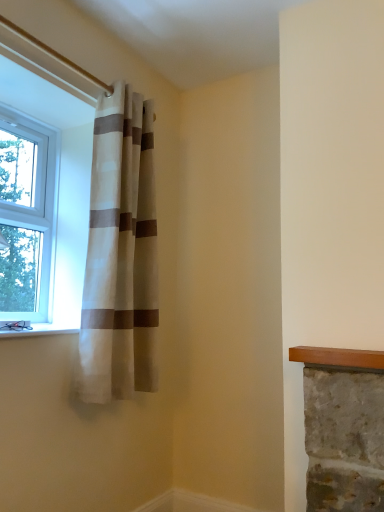
Describe the element at coordinates (40, 330) in the screenshot. The height and width of the screenshot is (512, 384). I see `white stone window sill at lower left` at that location.

The height and width of the screenshot is (512, 384). I want to click on beige/white striped curtain at upper left, so click(121, 254).

In order to click on window on the left of the white stone window sill at lower left in this screenshot , I will do coord(26,219).

Which object is more forward, clear glass window at left or white stone window sill at lower left?

white stone window sill at lower left is in front.

Is clear glass window at left next to white stone window sill at lower left?

No, clear glass window at left is not with white stone window sill at lower left.

Based on the photo, is white stone window sill at lower left next to clear glass window at left?

No, white stone window sill at lower left is not next to clear glass window at left.

Does white stone window sill at lower left turn towards clear glass window at left?

No, white stone window sill at lower left does not turn towards clear glass window at left.

Between white stone window sill at lower left and clear glass window at left, which one has smaller size?

white stone window sill at lower left is smaller.

Is point (55, 324) closer or farther from the camera than point (48, 264)?

Point (55, 324) is closer to the camera than point (48, 264).

Can you confirm if beige/white striped curtain at upper left is smaller than clear glass window at left?

No, beige/white striped curtain at upper left is not smaller than clear glass window at left.

Is point (152, 255) more distant than point (4, 255)?

Yes, it is behind point (4, 255).

Is beige/white striped curtain at upper left oriented away from clear glass window at left?

Yes, beige/white striped curtain at upper left's orientation is away from clear glass window at left.

From a real-world perspective, between beige/white striped curtain at upper left and clear glass window at left, who is vertically lower?

In real-world perspective, beige/white striped curtain at upper left is lower.

Which of these two, beige/white striped curtain at upper left or white stone window sill at lower left, stands taller?

beige/white striped curtain at upper left is taller.

Can you confirm if beige/white striped curtain at upper left is thinner than white stone window sill at lower left?

Yes, beige/white striped curtain at upper left is thinner than white stone window sill at lower left.

Looking at this image, is white stone window sill at lower left at the back of beige/white striped curtain at upper left?

No, beige/white striped curtain at upper left's orientation is not away from white stone window sill at lower left.

Is beige/white striped curtain at upper left further to the viewer compared to white stone window sill at lower left?

Yes, the depth of beige/white striped curtain at upper left is greater than that of white stone window sill at lower left.

Between white stone window sill at lower left and beige/white striped curtain at upper left, which one is positioned behind?

beige/white striped curtain at upper left is behind.

Is white stone window sill at lower left situated inside beige/white striped curtain at upper left or outside?

white stone window sill at lower left cannot be found inside beige/white striped curtain at upper left.

Based on the photo, from a real-world perspective, between white stone window sill at lower left and beige/white striped curtain at upper left, who is vertically higher?

From a 3D spatial view, beige/white striped curtain at upper left is above.

Is white stone window sill at lower left to the left of beige/white striped curtain at upper left from the viewer's perspective?

Yes, white stone window sill at lower left is to the left of beige/white striped curtain at upper left.

Which object is closer to the camera taking this photo, clear glass window at left or beige/white striped curtain at upper left?

beige/white striped curtain at upper left is closer to the camera.

Can you confirm if clear glass window at left is wider than beige/white striped curtain at upper left?

In fact, clear glass window at left might be narrower than beige/white striped curtain at upper left.

Choose the correct answer: Is clear glass window at left inside beige/white striped curtain at upper left or outside it?

clear glass window at left cannot be found inside beige/white striped curtain at upper left.

The width and height of the screenshot is (384, 512). I want to click on window sill below the clear glass window at left (from the image's perspective), so click(40, 330).

Identify the location of window sill that appears below the clear glass window at left (from a real-world perspective). (40, 330).

Which object lies nearer to the anchor point beige/white striped curtain at upper left, white stone window sill at lower left or clear glass window at left?

The object closer to beige/white striped curtain at upper left is clear glass window at left.

Which object lies further to the anchor point clear glass window at left, beige/white striped curtain at upper left or white stone window sill at lower left?

The object further to clear glass window at left is white stone window sill at lower left.

When comparing their distances from white stone window sill at lower left, does beige/white striped curtain at upper left or clear glass window at left seem closer?

The object closer to white stone window sill at lower left is beige/white striped curtain at upper left.

Estimate the real-world distances between objects in this image. Which object is further from white stone window sill at lower left, clear glass window at left or beige/white striped curtain at upper left?

clear glass window at left is further to white stone window sill at lower left.

From the image, which object appears to be nearer to beige/white striped curtain at upper left, clear glass window at left or white stone window sill at lower left?

Based on the image, clear glass window at left appears to be nearer to beige/white striped curtain at upper left.

Considering their positions, is white stone window sill at lower left positioned closer to clear glass window at left than beige/white striped curtain at upper left?

beige/white striped curtain at upper left.

The width and height of the screenshot is (384, 512). In order to click on window sill between clear glass window at left and beige/white striped curtain at upper left in this screenshot , I will do `click(40, 330)`.